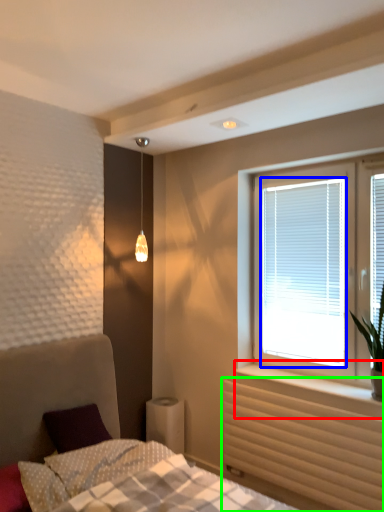
Question: Considering the real-world distances, which object is farthest from window sill (highlighted by a red box)? window screen (highlighted by a blue box) or radiator (highlighted by a green box)?

Choices:
 (A) window screen
 (B) radiator

Answer: (A)